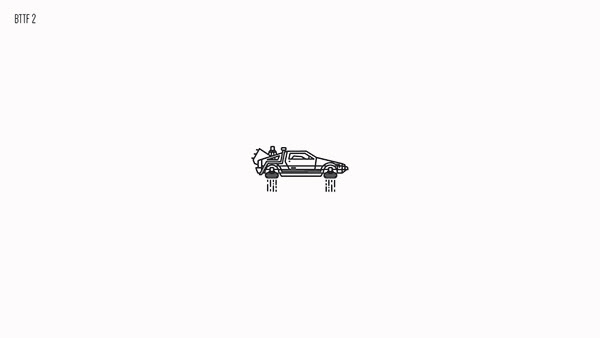
What are the coordinates of `windows` in the screenshot? It's located at (306, 155), (272, 158).